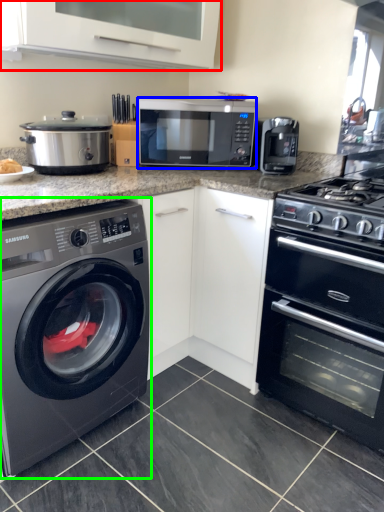
Question: Which is nearer to the vent (highlighted by a red box)? microwave oven (highlighted by a blue box) or washing machine (highlighted by a green box).

Choices:
 (A) microwave oven
 (B) washing machine

Answer: (A)